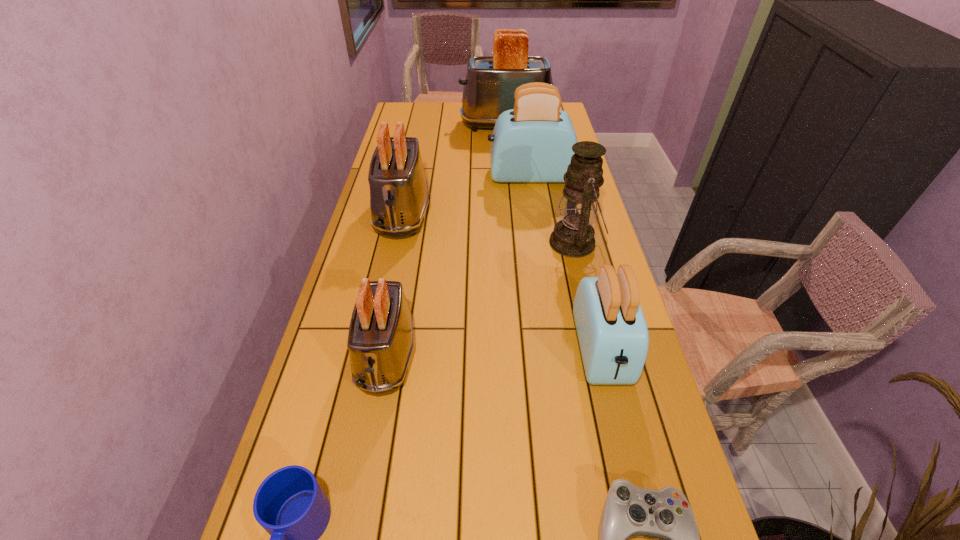
At what (x,y) coordinates should I click in order to perform the action: click on vacant space at the left edge of the desktop. Please return your answer as a coordinate pair (x, y). Looking at the image, I should click on (293, 460).

This screenshot has height=540, width=960. Find the location of `free space at the right edge of the desktop`. free space at the right edge of the desktop is located at coordinates (603, 488).

Locate an element on the screen. free point between the biggest gray toaster and the green oil lamp is located at coordinates (540, 184).

Locate an element on the screen. This screenshot has width=960, height=540. free spot between the bigger light toaster and the nearer light toaster is located at coordinates (565, 264).

I want to click on empty location between the biggest gray toaster and the second nearest gray toaster, so click(454, 170).

At what (x,y) coordinates should I click in order to perform the action: click on free point between the green oil lamp and the farthest toaster. Please return your answer as a coordinate pair (x, y). The image size is (960, 540). Looking at the image, I should click on (540, 184).

At what (x,y) coordinates should I click in order to perform the action: click on the fifth closest object relative to the smaller light toaster. Please return your answer as a coordinate pair (x, y). Image resolution: width=960 pixels, height=540 pixels. Looking at the image, I should click on (290, 505).

You are a GUI agent. You are given a task and a screenshot of the screen. Output one action in this format:
    pyautogui.click(x=<x>, y=<y>)
    Task: Click on the sixth closest object to the smaller light toaster
    This screenshot has height=540, width=960.
    Given the screenshot: What is the action you would take?
    pyautogui.click(x=533, y=142)

Locate which toaster ranks in proximity to the nearest gray toaster. Please provide its 2D coordinates. Your answer should be formatted as a tuple, i.e. [(x, y)], where the tuple contains the x and y coordinates of a point satisfying the conditions above.

[(399, 196)]

Identify which toaster is the closest to the blue mug. Please provide its 2D coordinates. Your answer should be formatted as a tuple, i.e. [(x, y)], where the tuple contains the x and y coordinates of a point satisfying the conditions above.

[(380, 341)]